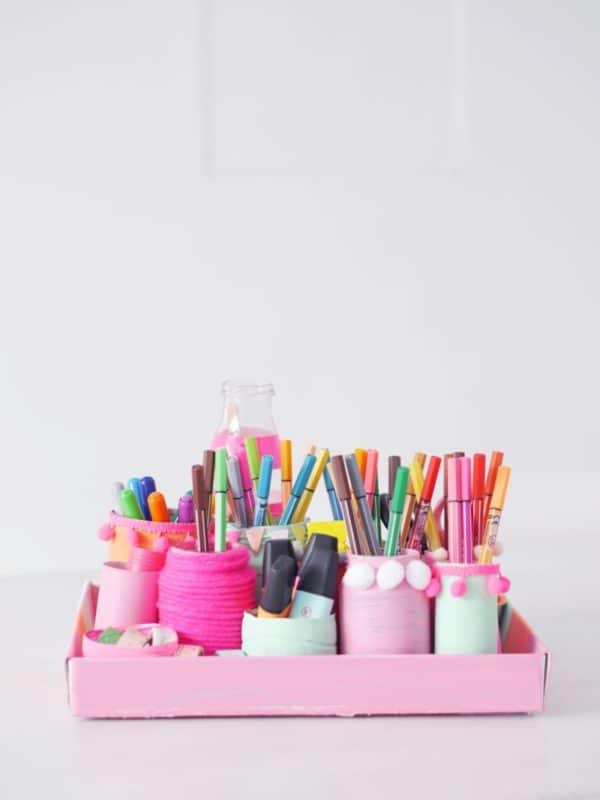
Where is `orange and red marker`? orange and red marker is located at coordinates (479, 506), (490, 484), (424, 498), (358, 454), (285, 458), (309, 488), (502, 494), (428, 528), (409, 510).